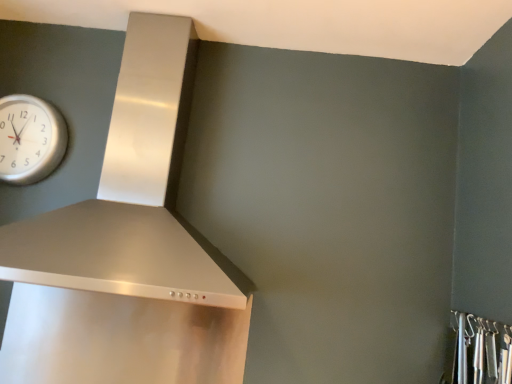
What do you see at coordinates (480, 351) in the screenshot?
I see `metallic silver hooks at lower right` at bounding box center [480, 351].

Identify the location of metallic silver hooks at lower right. The width and height of the screenshot is (512, 384). (480, 351).

Is point (31, 163) behind point (496, 350)?

Yes, point (31, 163) is farther from viewer.

From a real-world perspective, who is located higher, silver metallic clock at upper left or metallic silver hooks at lower right?

From a 3D spatial view, silver metallic clock at upper left is above.

From the image's perspective, is silver metallic clock at upper left above or below metallic silver hooks at lower right?

From the image's perspective, silver metallic clock at upper left appears above metallic silver hooks at lower right.

From the image's perspective, is metallic silver hooks at lower right positioned above or below satin silver vent at upper left?

From the image's perspective, metallic silver hooks at lower right appears below satin silver vent at upper left.

Is metallic silver hooks at lower right surrounding satin silver vent at upper left?

No, metallic silver hooks at lower right does not contain satin silver vent at upper left.

Between metallic silver hooks at lower right and satin silver vent at upper left, which one appears on the right side from the viewer's perspective?

metallic silver hooks at lower right.

Which object is thinner, metallic silver hooks at lower right or satin silver vent at upper left?

metallic silver hooks at lower right.

This screenshot has height=384, width=512. In order to click on vent below the silver metallic clock at upper left (from a real-world perspective) in this screenshot , I will do `click(133, 193)`.

Is silver metallic clock at upper left at the right side of satin silver vent at upper left?

Incorrect, silver metallic clock at upper left is not on the right side of satin silver vent at upper left.

Does silver metallic clock at upper left turn towards satin silver vent at upper left?

No.

Looking at their sizes, would you say silver metallic clock at upper left is wider or thinner than satin silver vent at upper left?

In the image, silver metallic clock at upper left appears to be more narrow than satin silver vent at upper left.

Is silver metallic clock at upper left inside metallic silver hooks at lower right?

No, silver metallic clock at upper left is not inside metallic silver hooks at lower right.

Measure the distance between metallic silver hooks at lower right and silver metallic clock at upper left.

A distance of 1.65 meters exists between metallic silver hooks at lower right and silver metallic clock at upper left.

Looking at this image, from the image's perspective, is metallic silver hooks at lower right positioned above or below silver metallic clock at upper left?

metallic silver hooks at lower right is situated lower than silver metallic clock at upper left in the image.

Does satin silver vent at upper left appear on the left side of silver metallic clock at upper left?

In fact, satin silver vent at upper left is to the right of silver metallic clock at upper left.

Is point (143, 138) closer to camera compared to point (24, 147)?

Yes.

From the image's perspective, between satin silver vent at upper left and silver metallic clock at upper left, who is located below?

From the image's view, satin silver vent at upper left is below.

Is satin silver vent at upper left far away from silver metallic clock at upper left?

No, satin silver vent at upper left is in close proximity to silver metallic clock at upper left.

From the image's perspective, would you say satin silver vent at upper left is positioned over metallic silver hooks at lower right?

Indeed, from the image's perspective, satin silver vent at upper left is shown above metallic silver hooks at lower right.

From their relative heights in the image, would you say satin silver vent at upper left is taller or shorter than metallic silver hooks at lower right?

satin silver vent at upper left is taller than metallic silver hooks at lower right.

Considering the points (133, 186) and (467, 377), which point is behind, point (133, 186) or point (467, 377)?

The point (133, 186) is behind.

At what (x,y) coordinates should I click in order to perform the action: click on closet in front of the silver metallic clock at upper left. Please return your answer as a coordinate pair (x, y). This screenshot has height=384, width=512. Looking at the image, I should click on (480, 351).

You are a GUI agent. You are given a task and a screenshot of the screen. Output one action in this format:
    pyautogui.click(x=<x>, y=<y>)
    Task: Click on the closet located on the right of satin silver vent at upper left
    
    Given the screenshot: What is the action you would take?
    pyautogui.click(x=480, y=351)

Looking at the image, which one is located further to metallic silver hooks at lower right, silver metallic clock at upper left or satin silver vent at upper left?

silver metallic clock at upper left lies further to metallic silver hooks at lower right than the other object.

Which object lies nearer to the anchor point metallic silver hooks at lower right, satin silver vent at upper left or silver metallic clock at upper left?

satin silver vent at upper left is positioned closer to the anchor metallic silver hooks at lower right.

When comparing their distances from satin silver vent at upper left, does silver metallic clock at upper left or metallic silver hooks at lower right seem further?

metallic silver hooks at lower right.

When comparing their distances from silver metallic clock at upper left, does metallic silver hooks at lower right or satin silver vent at upper left seem further?

Based on the image, metallic silver hooks at lower right appears to be further to silver metallic clock at upper left.

Based on their spatial positions, is satin silver vent at upper left or metallic silver hooks at lower right further from silver metallic clock at upper left?

metallic silver hooks at lower right is positioned further to the anchor silver metallic clock at upper left.

Looking at the image, which one is located further to satin silver vent at upper left, metallic silver hooks at lower right or silver metallic clock at upper left?

metallic silver hooks at lower right.

The image size is (512, 384). I want to click on vent between silver metallic clock at upper left and metallic silver hooks at lower right, so click(133, 193).